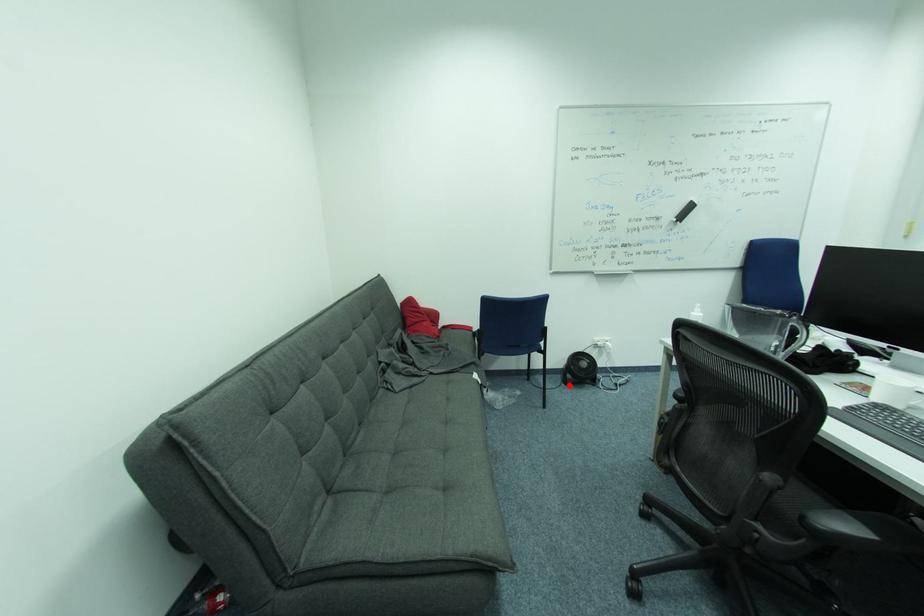
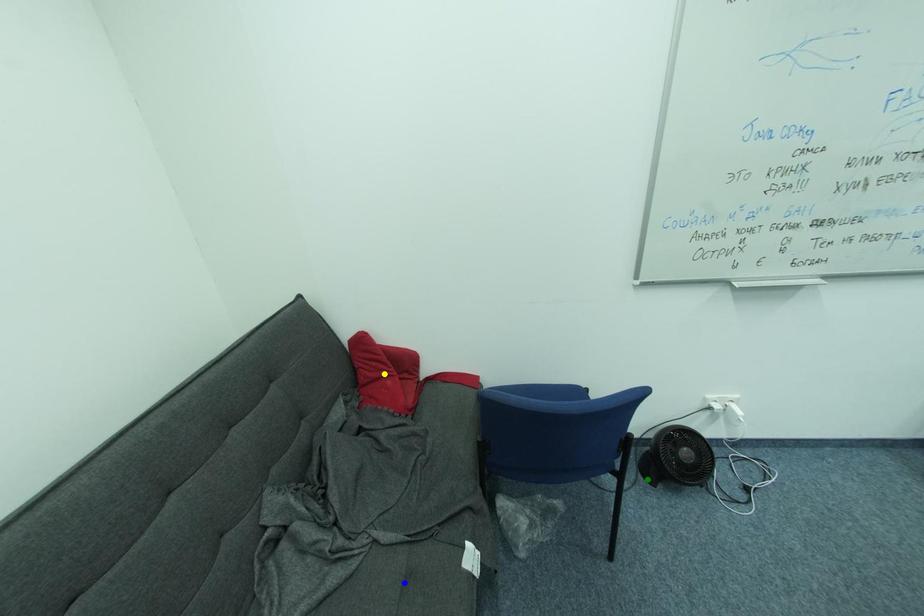
Question: I am providing you with two images of the same scene from different viewpoints. A red point is marked on the first image. You are given multiple points on the second image. In image 2, which mark is for the same physical point as the one in image 1?

Choices:
 (A) green point
 (B) blue point
 (C) yellow point

Answer: (A)